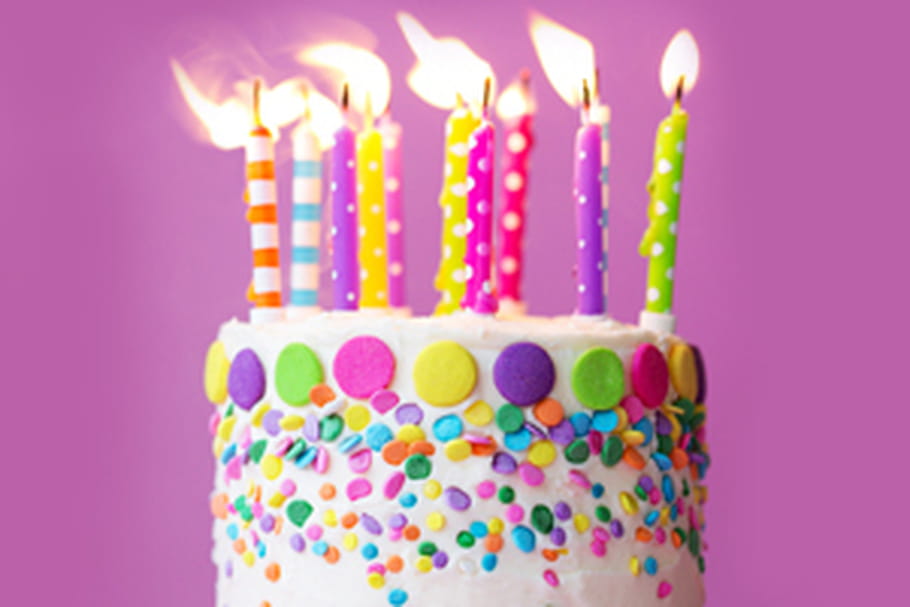
At what (x,y) coordinates should I click in order to perform the action: click on birthday candle flames. Please return your answer as a coordinate pair (x, y). Looking at the image, I should click on (231, 117), (291, 104), (312, 121), (344, 72), (429, 92), (467, 82), (517, 104), (559, 53), (679, 65).